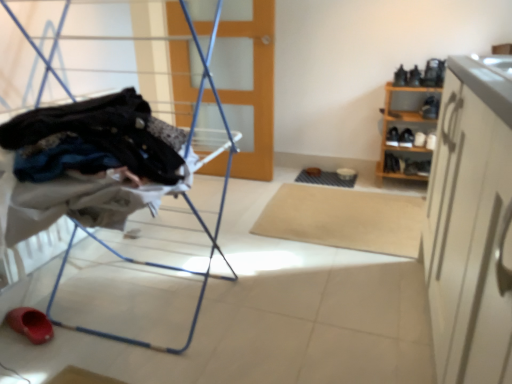
The image size is (512, 384). Describe the element at coordinates (344, 219) in the screenshot. I see `beige carpet at center` at that location.

What is the approximate height of metal laundry rack at left?

It is 3.80 feet.

The height and width of the screenshot is (384, 512). Identify the location of wooden at center. click(255, 91).

What is the approximate height of rubber/soft sole shoe at lower left?

It is 6.38 centimeters.

Image resolution: width=512 pixels, height=384 pixels. I want to click on beige carpet at center, so click(x=344, y=219).

Which of these two, wooden at center or rubber/soft sole shoe at lower left, is wider?

rubber/soft sole shoe at lower left is wider.

Is wooden at center oriented away from rubber/soft sole shoe at lower left?

No, wooden at center's orientation is not away from rubber/soft sole shoe at lower left.

From the image's perspective, is wooden at center under rubber/soft sole shoe at lower left?

Actually, wooden at center appears above rubber/soft sole shoe at lower left in the image.

Which is behind, point (258, 15) or point (38, 341)?

The point (258, 15) is behind.

Is beige carpet at center completely or partially outside of wooden at center?

Yes, beige carpet at center is located beyond the bounds of wooden at center.

Are beige carpet at center and wooden at center making contact?

No, beige carpet at center is not next to wooden at center.

Relative to wooden at center, is beige carpet at center in front or behind?

In the image, beige carpet at center appears in front of wooden at center.

Are rubber/soft sole shoe at lower left and beige carpet at center making contact?

No, rubber/soft sole shoe at lower left is not in contact with beige carpet at center.

Is rubber/soft sole shoe at lower left behind beige carpet at center?

No, it is not.

Choose the correct answer: Is rubber/soft sole shoe at lower left inside beige carpet at center or outside it?

The correct answer is: outside.

Could you tell me if rubber/soft sole shoe at lower left is facing beige carpet at center?

No, rubber/soft sole shoe at lower left does not turn towards beige carpet at center.

Looking at this image, is rubber/soft sole shoe at lower left shorter than wooden shoe rack at right?

Correct, rubber/soft sole shoe at lower left is not as tall as wooden shoe rack at right.

Between rubber/soft sole shoe at lower left and wooden shoe rack at right, which one appears on the left side from the viewer's perspective?

From the viewer's perspective, rubber/soft sole shoe at lower left appears more on the left side.

What's the angular difference between rubber/soft sole shoe at lower left and wooden shoe rack at right's facing directions?

68.7 degrees separate the facing orientations of rubber/soft sole shoe at lower left and wooden shoe rack at right.

Does rubber/soft sole shoe at lower left have a lesser width compared to wooden shoe rack at right?

Indeed, rubber/soft sole shoe at lower left has a lesser width compared to wooden shoe rack at right.

Considering the sizes of objects wooden at center and wooden shoe rack at right in the image provided, who is shorter, wooden at center or wooden shoe rack at right?

wooden shoe rack at right.

Are wooden at center and wooden shoe rack at right making contact?

No, wooden at center is not touching wooden shoe rack at right.

From a real-world perspective, which object stands above the other?

From a 3D spatial view, wooden at center is above.

Based on the photo, can you confirm if wooden shoe rack at right is shorter than wooden at center?

Correct, wooden shoe rack at right is not as tall as wooden at center.

The width and height of the screenshot is (512, 384). Identify the location of door that is above the wooden shoe rack at right (from a real-world perspective). (255, 91).

Is wooden shoe rack at right turned away from wooden at center?

wooden shoe rack at right does not have its back to wooden at center.

Considering the relative sizes of wooden shoe rack at right and beige carpet at center in the image provided, is wooden shoe rack at right wider than beige carpet at center?

No, wooden shoe rack at right is not wider than beige carpet at center.

Could you tell me if wooden shoe rack at right is facing beige carpet at center?

Yes, wooden shoe rack at right faces towards beige carpet at center.

Considering the relative sizes of wooden shoe rack at right and beige carpet at center in the image provided, is wooden shoe rack at right bigger than beige carpet at center?

Indeed, wooden shoe rack at right has a larger size compared to beige carpet at center.

Is wooden shoe rack at right next to beige carpet at center?

No.

Locate an element on the screen. The width and height of the screenshot is (512, 384). door on the right side of rubber/soft sole shoe at lower left is located at coordinates (255, 91).

What are the coordinates of `mat below the wooden at center (from a real-world perspective)` in the screenshot? It's located at (344, 219).

From the image, which object appears to be farther from beige carpet at center, wooden shoe rack at right or wooden at center?

wooden at center.

From the image, which object appears to be nearer to metal laundry rack at left, wooden shoe rack at right or wooden at center?

Among the two, wooden at center is located nearer to metal laundry rack at left.

When comparing their distances from wooden shoe rack at right, does rubber/soft sole shoe at lower left or metal laundry rack at left seem further?

rubber/soft sole shoe at lower left is further to wooden shoe rack at right.

From the image, which object appears to be nearer to wooden at center, rubber/soft sole shoe at lower left or metal laundry rack at left?

metal laundry rack at left is closer to wooden at center.

From the image, which object appears to be nearer to wooden at center, metal laundry rack at left or wooden shoe rack at right?

Among the two, wooden shoe rack at right is located nearer to wooden at center.

When comparing their distances from beige carpet at center, does rubber/soft sole shoe at lower left or wooden shoe rack at right seem closer?

Among the two, wooden shoe rack at right is located nearer to beige carpet at center.

Which object lies nearer to the anchor point wooden shoe rack at right, beige carpet at center or metal laundry rack at left?

beige carpet at center is positioned closer to the anchor wooden shoe rack at right.

Which object lies further to the anchor point rubber/soft sole shoe at lower left, wooden at center or metal laundry rack at left?

wooden at center is further to rubber/soft sole shoe at lower left.

Where is `mat located between rubber/soft sole shoe at lower left and wooden shoe rack at right in the left-right direction`? This screenshot has width=512, height=384. mat located between rubber/soft sole shoe at lower left and wooden shoe rack at right in the left-right direction is located at coordinates (344, 219).

Find the location of `door located between metal laundry rack at left and wooden shoe rack at right in the depth direction`. door located between metal laundry rack at left and wooden shoe rack at right in the depth direction is located at coordinates (255, 91).

Image resolution: width=512 pixels, height=384 pixels. I want to click on mat positioned between metal laundry rack at left and wooden at center from near to far, so click(344, 219).

Find the location of a particular element. door situated between rubber/soft sole shoe at lower left and beige carpet at center from left to right is located at coordinates (255, 91).